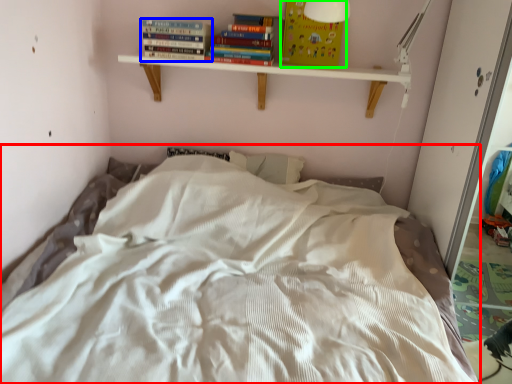
Question: Which is farther away from bed (highlighted by a red box)? book (highlighted by a blue box) or paperback book (highlighted by a green box)?

Choices:
 (A) book
 (B) paperback book

Answer: (B)